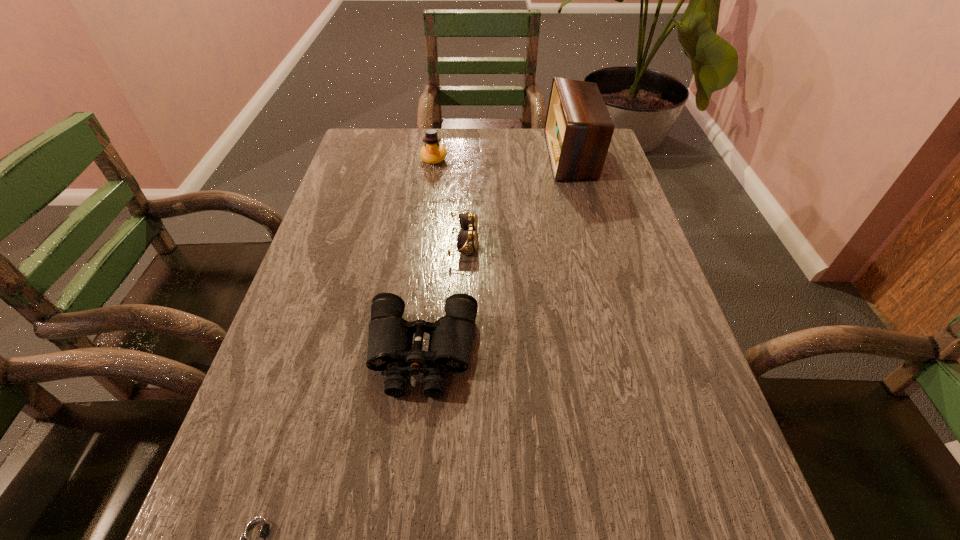
Find the location of `free area in between the rightmost object and the duck`. free area in between the rightmost object and the duck is located at coordinates (503, 157).

Where is `free point between the tallest object and the second nearest object`? This screenshot has width=960, height=540. free point between the tallest object and the second nearest object is located at coordinates (496, 254).

This screenshot has height=540, width=960. In order to click on empty location between the second shortest object and the rightmost object in this screenshot , I will do `click(517, 198)`.

You are a GUI agent. You are given a task and a screenshot of the screen. Output one action in this format:
    pyautogui.click(x=<x>, y=<y>)
    Task: Click on the empty space between the goggles and the radio receiver
    This screenshot has height=540, width=960.
    Given the screenshot: What is the action you would take?
    pyautogui.click(x=517, y=198)

Locate an element on the screen. This screenshot has height=540, width=960. free space between the radio receiver and the duck is located at coordinates point(503,157).

You are a GUI agent. You are given a task and a screenshot of the screen. Output one action in this format:
    pyautogui.click(x=<x>, y=<y>)
    Task: Click on the free space that is in between the second nearest object and the rightmost object
    This screenshot has width=960, height=540.
    Given the screenshot: What is the action you would take?
    pyautogui.click(x=496, y=254)

Select which object is the second closest to the fourth shortest object. Please provide its 2D coordinates. Your answer should be formatted as a tuple, i.e. [(x, y)], where the tuple contains the x and y coordinates of a point satisfying the conditions above.

[(578, 129)]

At what (x,y) coordinates should I click in order to perform the action: click on object that can be found as the second closest to the duck. Please return your answer as a coordinate pair (x, y). This screenshot has width=960, height=540. Looking at the image, I should click on (578, 129).

Identify the location of vacant space that satisfies the following two spatial constraints: 1. on the front-facing side of the radio receiver; 2. on the front-facing side of the fourth shortest object. (572, 159).

Identify the location of blank space that satisfies the following two spatial constraints: 1. on the front-facing side of the tallest object; 2. on the front-facing side of the duck. (572, 159).